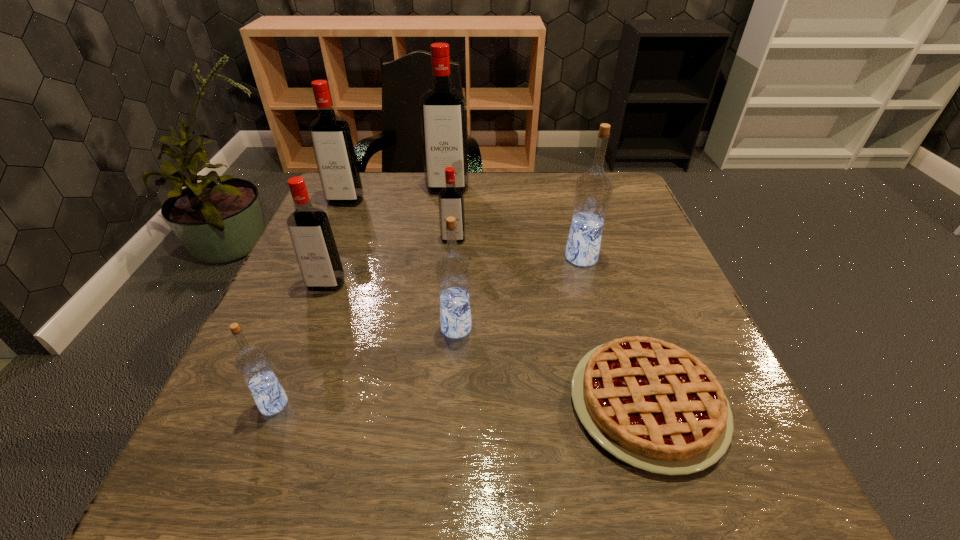
This screenshot has height=540, width=960. What are the coordinates of `the third farthest vodka` in the screenshot? It's located at (450, 199).

In order to click on the nearest blue vodka in this screenshot , I will do `click(253, 364)`.

Identify the location of the nearest vodka. (253, 364).

This screenshot has height=540, width=960. In order to click on the shortest object in this screenshot , I will do `click(651, 404)`.

You are a GUI agent. You are given a task and a screenshot of the screen. Output one action in this format:
    pyautogui.click(x=<x>, y=<y>)
    Task: Click on the pie
    This screenshot has width=960, height=540.
    Given the screenshot: What is the action you would take?
    pyautogui.click(x=651, y=404)

You are a GUI agent. You are given a task and a screenshot of the screen. Output one action in this format:
    pyautogui.click(x=<x>, y=<y>)
    Task: Click on the vacant space positioned on the front and back of the tallest object
    This screenshot has width=960, height=540.
    Given the screenshot: What is the action you would take?
    pyautogui.click(x=444, y=215)

You are a GUI agent. You are given a task and a screenshot of the screen. Output one action in this format:
    pyautogui.click(x=<x>, y=<y>)
    Task: Click on the vacant area located 0.290m on the front and back of the third smallest red vodka
    The width and height of the screenshot is (960, 540).
    Given the screenshot: What is the action you would take?
    pyautogui.click(x=310, y=283)

At what (x,y) coordinates should I click in order to perform the action: click on vacant space located 0.260m on the front of the rightmost vodka. Please return your answer as a coordinate pair (x, y). Looking at the image, I should click on (612, 366).

Find the location of a particular element. vacant region located 0.390m on the back of the second biggest blue vodka is located at coordinates (463, 206).

The image size is (960, 540). I want to click on free space located on the front and back of the third biggest red vodka, so coord(267,436).